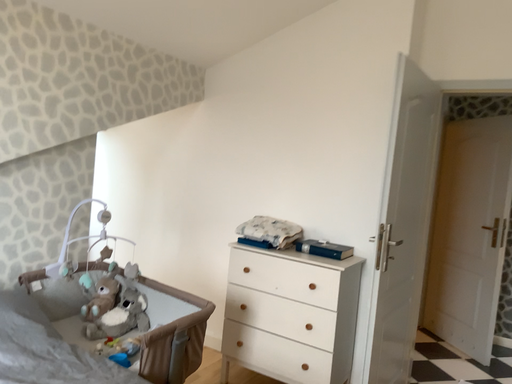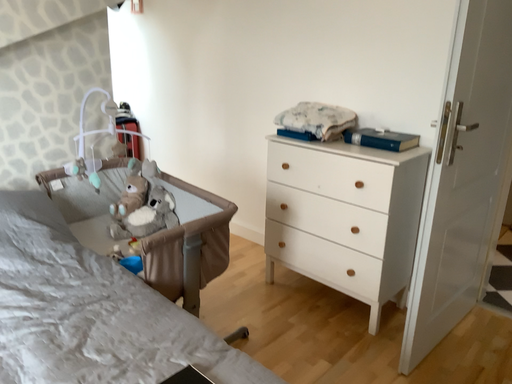
Question: How did the camera likely rotate when shooting the video?

Choices:
 (A) rotated downward
 (B) rotated upward

Answer: (A)